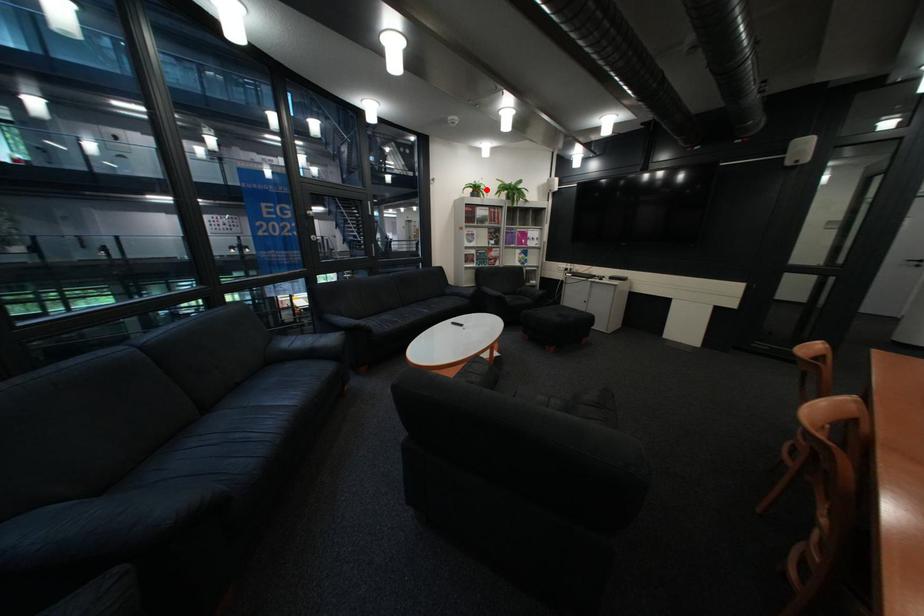
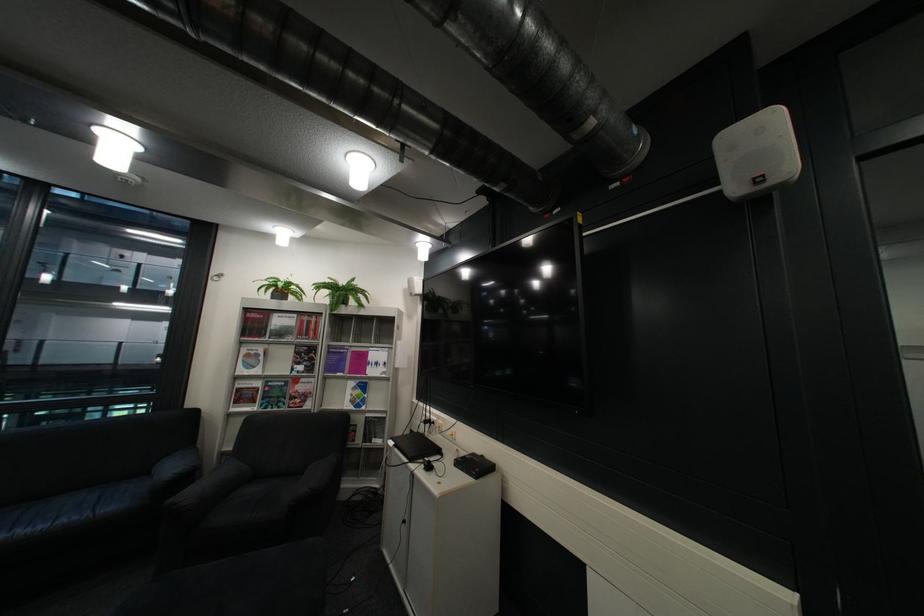
Question: I am providing you with two images of the same scene from different viewpoints. In image1, a red point is highlighted. Considering the same 3D point in image2, which of the following is correct?

Choices:
 (A) It is closer
 (B) It is farther

Answer: (B)